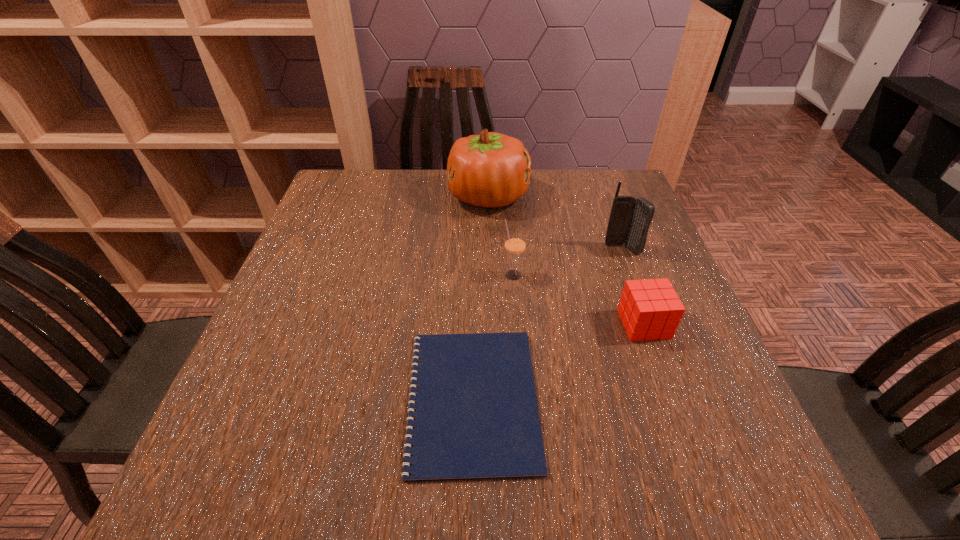
Where is `free point at the far left corner`? free point at the far left corner is located at coordinates click(378, 196).

The height and width of the screenshot is (540, 960). In order to click on free space at the far right corner of the desktop in this screenshot , I will do `click(620, 174)`.

The image size is (960, 540). Find the location of `free spot between the cellular telephone and the straw`. free spot between the cellular telephone and the straw is located at coordinates (567, 262).

Where is `free space between the straw and the cellular telephone`? This screenshot has width=960, height=540. free space between the straw and the cellular telephone is located at coordinates (567, 262).

Find the location of `vacant space that's between the third tallest object and the cellular telephone`. vacant space that's between the third tallest object and the cellular telephone is located at coordinates (567, 262).

I want to click on free space between the notepad and the cube, so click(558, 361).

This screenshot has height=540, width=960. I want to click on free area in between the notepad and the farthest object, so click(480, 298).

Locate an element on the screen. This screenshot has width=960, height=540. vacant space that is in between the fourth nearest object and the shortest object is located at coordinates (547, 324).

Where is `vacant space that is in between the fourth nearest object and the straw`? vacant space that is in between the fourth nearest object and the straw is located at coordinates (567, 262).

The height and width of the screenshot is (540, 960). I want to click on free area in between the pumpkin and the second shortest object, so [x=566, y=260].